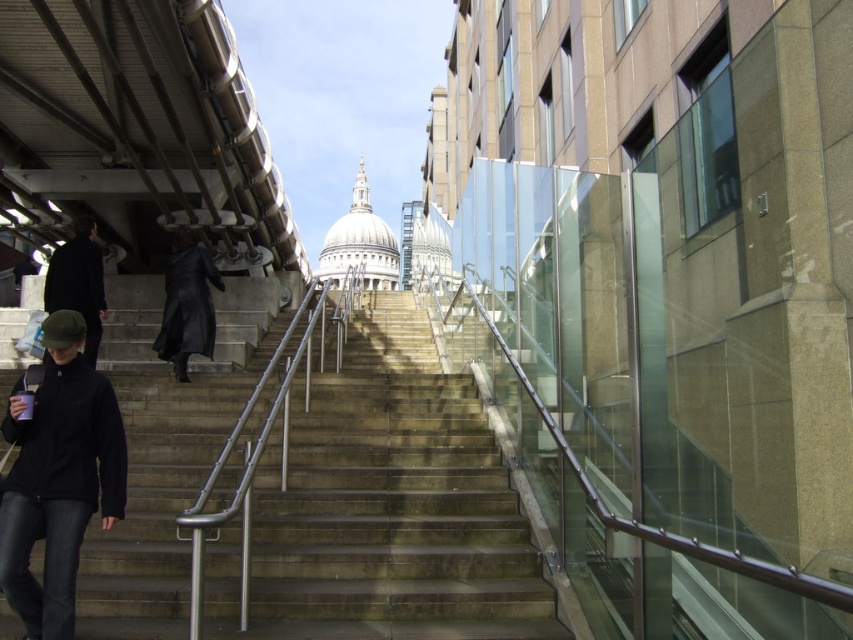
Question: Considering the real-world distances, which object is closest to the dark gray woolen jacket at left?

Choices:
 (A) black fleece jacket at lower left
 (B) concrete stairs at center
 (C) black leather coat at center

Answer: (C)

Question: Is concrete stairs at center thinner than black leather coat at center?

Choices:
 (A) no
 (B) yes

Answer: (A)

Question: Can you confirm if black leather coat at center is smaller than dark gray woolen jacket at left?

Choices:
 (A) no
 (B) yes

Answer: (B)

Question: Among these points, which one is farthest from the camera?

Choices:
 (A) (74, 296)
 (B) (450, 492)
 (C) (175, 308)
 (D) (62, 346)

Answer: (C)

Question: Based on their relative distances, which object is farther from the black fleece jacket at lower left?

Choices:
 (A) black leather coat at center
 (B) concrete stairs at center

Answer: (A)

Question: Does black leather coat at center appear on the left side of dark gray woolen jacket at left?

Choices:
 (A) no
 (B) yes

Answer: (A)